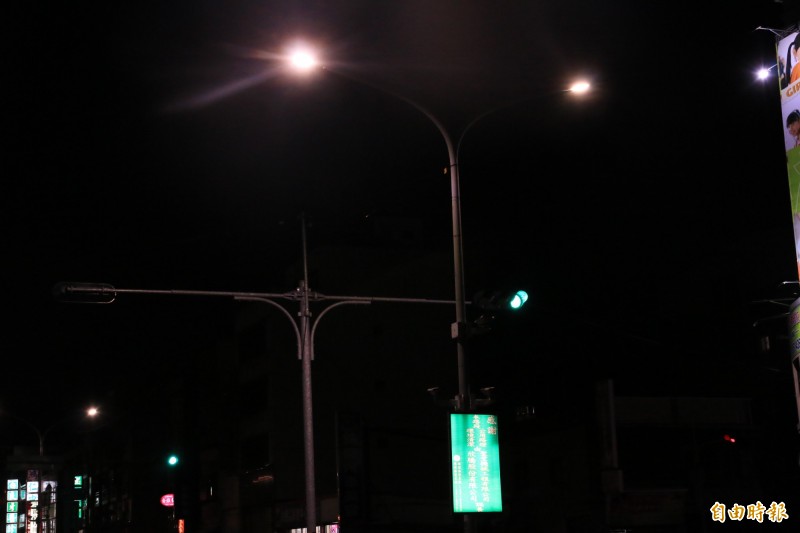
The height and width of the screenshot is (533, 800). What are the coordinates of `green light` in the screenshot? It's located at (514, 300).